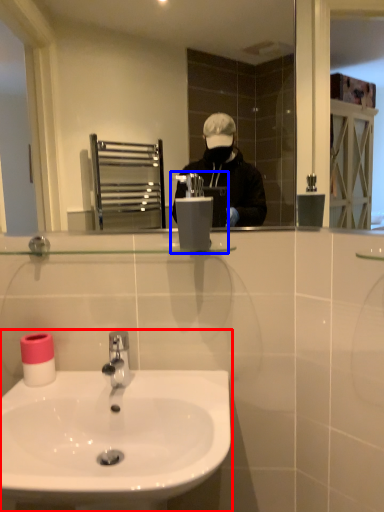
Question: Which of the following is the closest to the observer, sink (highlighted by a red box) or hand dryer (highlighted by a blue box)?

Choices:
 (A) sink
 (B) hand dryer

Answer: (A)